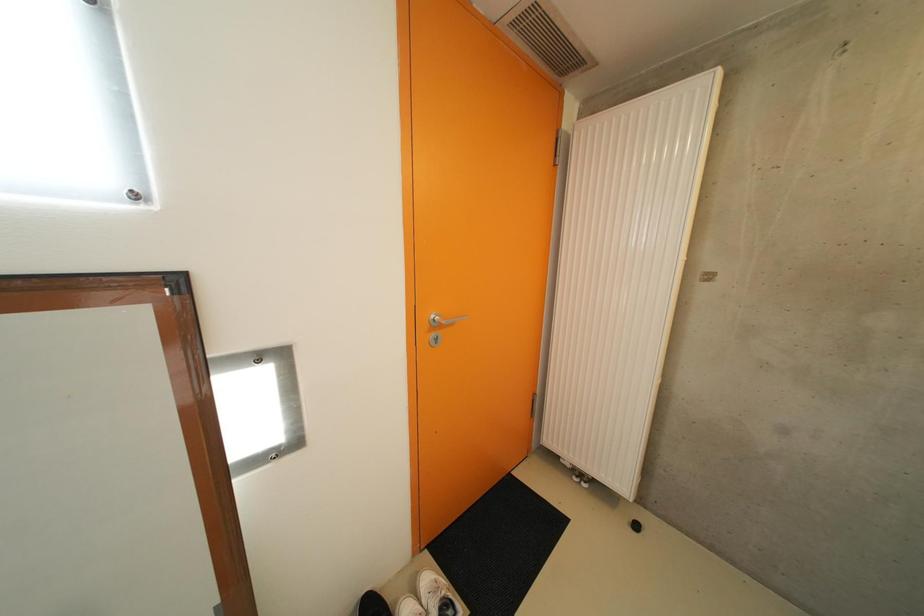
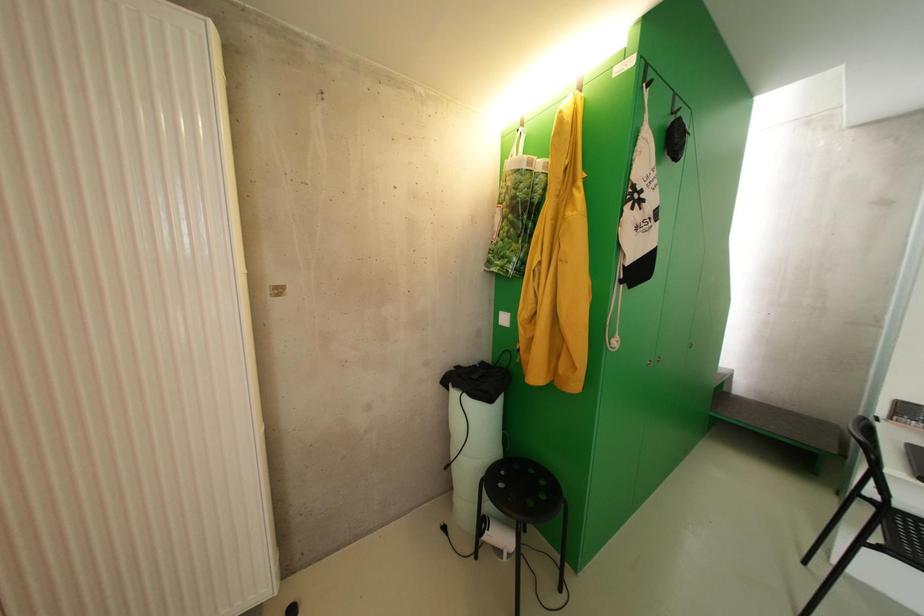
Question: The images are taken continuously from a first-person perspective. In which direction is your viewpoint rotating?

Choices:
 (A) Left
 (B) Right
 (C) Up
 (D) Down

Answer: (B)